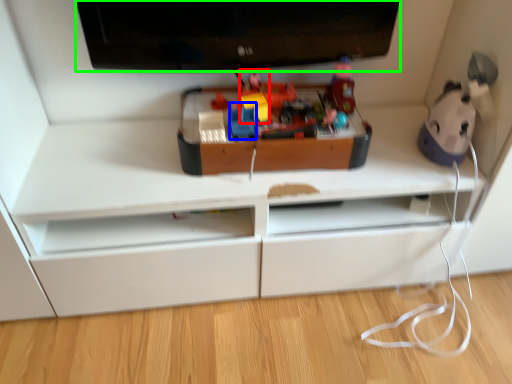
Question: Which object is the farthest from toy (highlighted by a red box)? Choose among these: toy (highlighted by a blue box) or television (highlighted by a green box).

Choices:
 (A) toy
 (B) television

Answer: (B)